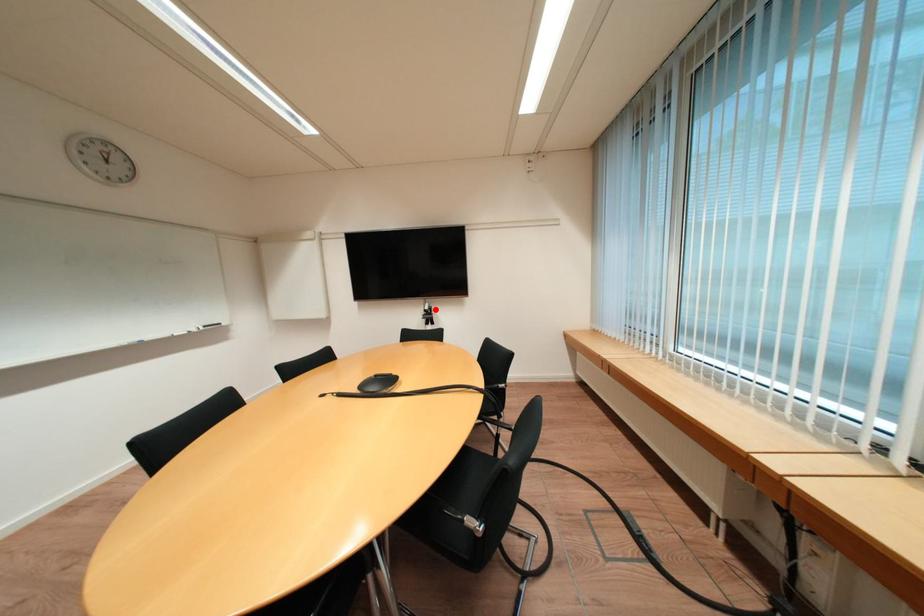
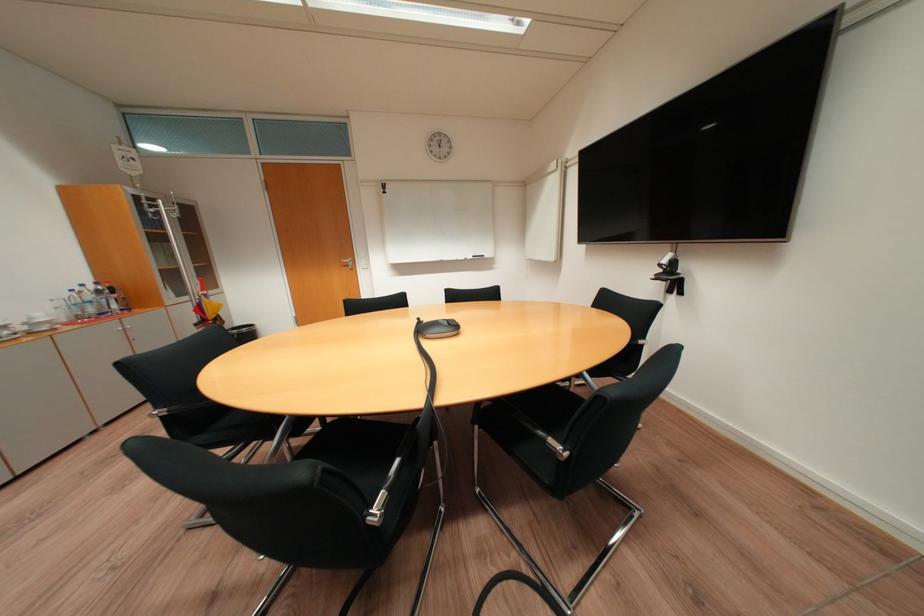
In the second image, find the point that corresponds to the highlighted location in the first image.

(673, 262)